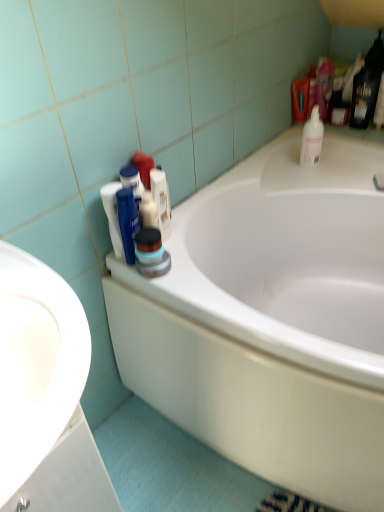
Question: Looking at their shapes, would you say white matte shaving cream at upper center is wider or thinner than white glossy sink at left?

Choices:
 (A) wide
 (B) thin

Answer: (B)

Question: From a real-world perspective, is white matte shaving cream at upper center physically located above or below white glossy sink at left?

Choices:
 (A) above
 (B) below

Answer: (B)

Question: Based on their relative distances, which object is nearer to the white glossy bathtub at center?

Choices:
 (A) white glossy sink at left
 (B) matte black container at center, the first cleaning product positioned from the left
 (C) white plastic bottle at upper right, the 2th cleaning product viewed from the left
 (D) white matte shaving cream at upper center

Answer: (D)

Question: Considering the real-world distances, which object is farthest from the white glossy sink at left?

Choices:
 (A) white matte shaving cream at upper center
 (B) matte black container at center, the 1th cleaning product in the front-to-back sequence
 (C) white plastic bottle at upper right, which is the first cleaning product from top to bottom
 (D) white glossy bathtub at center

Answer: (C)